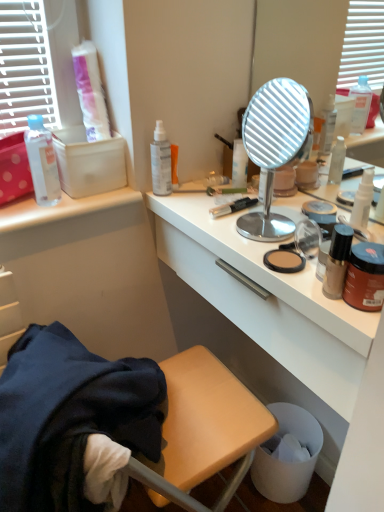
Identify the location of empty space that is in between transparent plastic spray bottle at upper center, marked as the 1th bottle in a back-to-front arrangement, and brown matte jar at right. (228, 229).